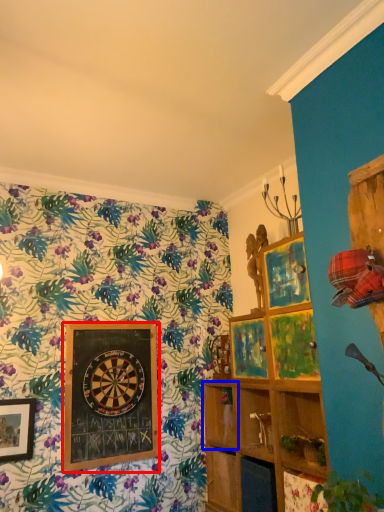
Question: Which object is closer to the camera taking this photo, picture frame (highlighted by a red box) or shelf (highlighted by a blue box)?

Choices:
 (A) picture frame
 (B) shelf

Answer: (A)